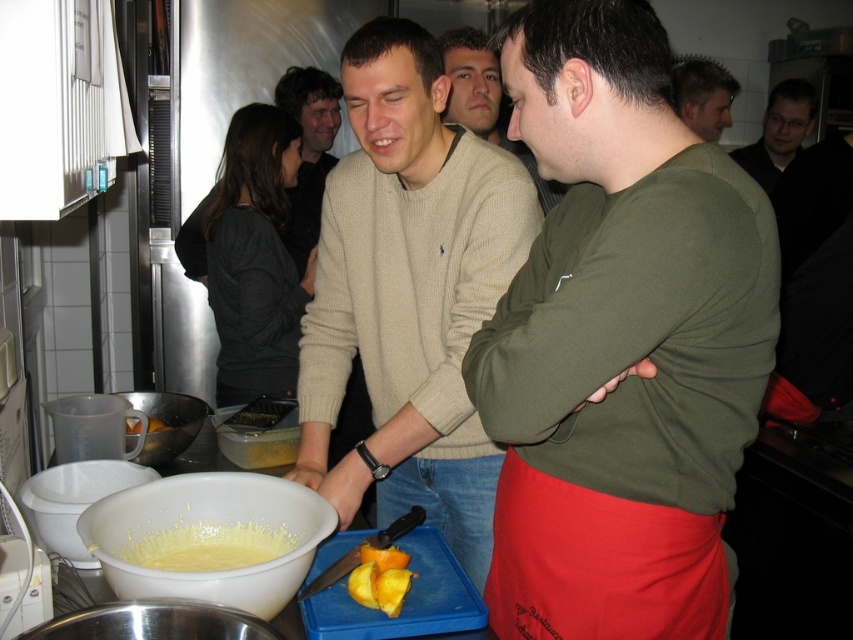
You are a chef in this kitchen and need to reach both the yellow matte batter at lower left and the yellow creamy food at center. Which item is positioned higher up?

The yellow matte batter at lower left is above the yellow creamy food at center, so it is positioned higher up.

From the picture: Where is the beige sweater at center located in the image?

The beige sweater at center is located at point [485,100].

Please look at the image. There is a point at coordinate (x=619, y=342). What object is located at this point?

The yellow matte batter at lower left is located at coordinate point (x=619, y=342).